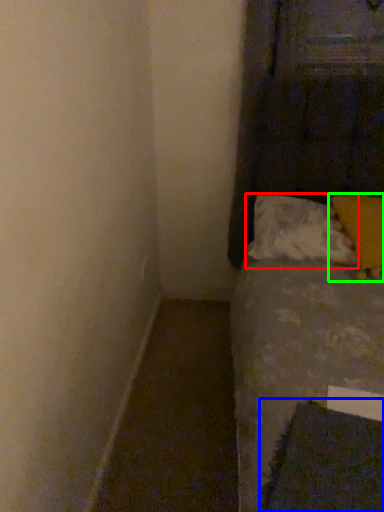
Question: Which is farther away from pillow (highlighted by a red box)? sheet (highlighted by a blue box) or pillow (highlighted by a green box)?

Choices:
 (A) sheet
 (B) pillow

Answer: (A)